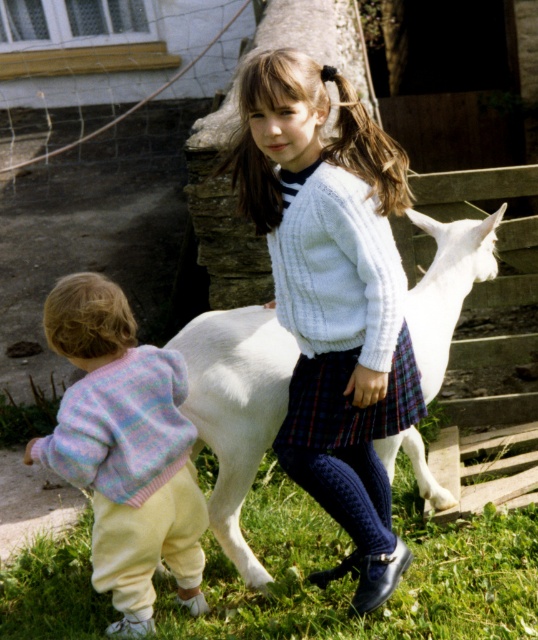
Measure the distance between green grass at lower center and camera.

The distance of green grass at lower center from camera is 3.06 meters.

Based on the photo, is green grass at lower center thinner than white woolen goat at center?

Incorrect, green grass at lower center's width is not less than white woolen goat at center's.

Who is more distant from viewer, (502, 534) or (230, 477)?

The point (502, 534) is behind.

Find the location of `green grass at lower center`. green grass at lower center is located at coordinates pyautogui.click(x=355, y=582).

Can you confirm if white knitted sweater at center is wider than green grass at lower center?

Incorrect, white knitted sweater at center's width does not surpass green grass at lower center's.

Identify the location of white knitted sweater at center. This screenshot has height=640, width=538. (332, 296).

The width and height of the screenshot is (538, 640). What are the coordinates of `white knitted sweater at center` in the screenshot? It's located at (332, 296).

Image resolution: width=538 pixels, height=640 pixels. I want to click on white knitted sweater at center, so click(332, 296).

Can you confirm if green grass at lower center is smaller than plaid fabric miniskirt at center?

Actually, green grass at lower center might be larger than plaid fabric miniskirt at center.

From the picture: Who is taller, green grass at lower center or plaid fabric miniskirt at center?

plaid fabric miniskirt at center is taller.

Is point (55, 566) in front of point (412, 401)?

No.

This screenshot has height=640, width=538. Identify the location of green grass at lower center. (355, 582).